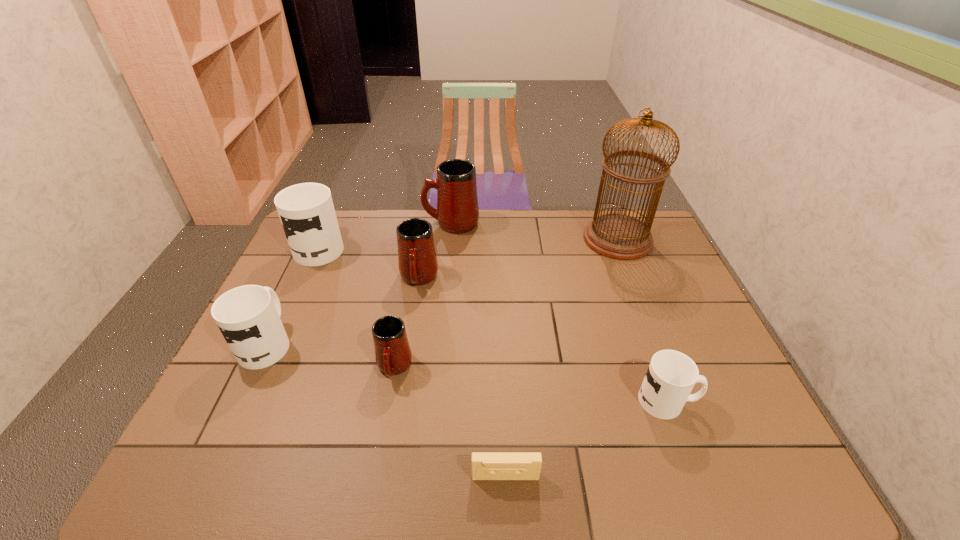
The height and width of the screenshot is (540, 960). I want to click on free space at the left edge of the desktop, so click(210, 411).

Identify the location of free point at the right edge. (669, 258).

In the image, there is a desktop. At what (x,y) coordinates should I click in order to perform the action: click on vacant space at the far left corner. Please return your answer as a coordinate pair (x, y). This screenshot has height=540, width=960. Looking at the image, I should click on (339, 218).

Where is `vacant space at the far right corner of the desktop`? Image resolution: width=960 pixels, height=540 pixels. vacant space at the far right corner of the desktop is located at coordinates (645, 220).

Locate an element on the screen. The height and width of the screenshot is (540, 960). free space at the near right corner is located at coordinates (758, 465).

The width and height of the screenshot is (960, 540). Identify the location of empty location between the biggest white mug and the nearest object. (413, 361).

Where is `free area in between the rightmost white mug and the videotape`? free area in between the rightmost white mug and the videotape is located at coordinates pyautogui.click(x=587, y=438).

In order to click on free spot between the beige videotape and the second nearest white mug in this screenshot , I will do `click(386, 409)`.

The image size is (960, 540). Find the location of `free space between the farthest red mug and the birdcage`. free space between the farthest red mug and the birdcage is located at coordinates (535, 231).

Locate an element on the screen. This screenshot has width=960, height=540. vacant region between the birdcage and the smallest red mug is located at coordinates (506, 303).